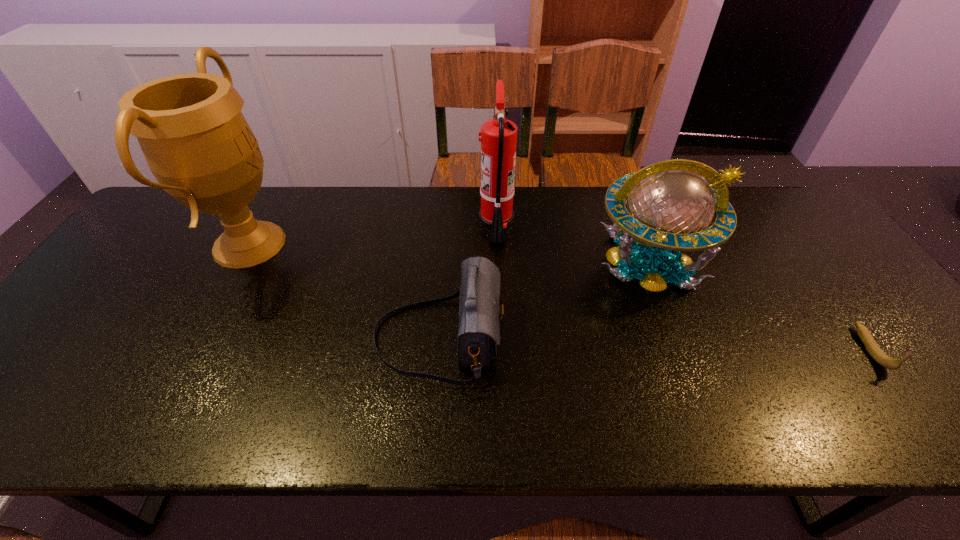
Where is `free area in between the globe and the shortest object`? free area in between the globe and the shortest object is located at coordinates (759, 305).

Image resolution: width=960 pixels, height=540 pixels. I want to click on the second closest object to the third shortest object, so click(479, 312).

Find the location of a particular element. This screenshot has width=960, height=540. object that stands as the fourth closest to the second tallest object is located at coordinates (874, 350).

You are a GUI agent. You are given a task and a screenshot of the screen. Output one action in this format:
    pyautogui.click(x=<x>, y=<y>)
    Task: Click on the vacant region that satisfies the following two spatial constraints: 1. on the engravings side of the leftmost object; 2. on the right side of the second shortest object
    
    Given the screenshot: What is the action you would take?
    pyautogui.click(x=199, y=337)

Where is `free spot that satisfies the following two spatial constraints: 1. on the engravings side of the fourth tallest object; 2. on the left side of the leftmost object`? free spot that satisfies the following two spatial constraints: 1. on the engravings side of the fourth tallest object; 2. on the left side of the leftmost object is located at coordinates (199, 337).

I want to click on free space that satisfies the following two spatial constraints: 1. on the back side of the third shortest object; 2. on the engravings side of the leftmost object, so click(643, 244).

The width and height of the screenshot is (960, 540). Find the location of `vacant space that satisfies the following two spatial constraints: 1. on the engravings side of the trophy; 2. on the back side of the globe`. vacant space that satisfies the following two spatial constraints: 1. on the engravings side of the trophy; 2. on the back side of the globe is located at coordinates (241, 260).